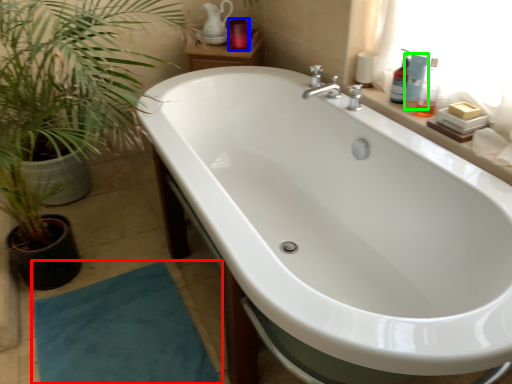
Question: Which is nearer to the doormat (highlighted by a red box)? toiletry (highlighted by a blue box) or toiletry (highlighted by a green box).

Choices:
 (A) toiletry
 (B) toiletry

Answer: (B)